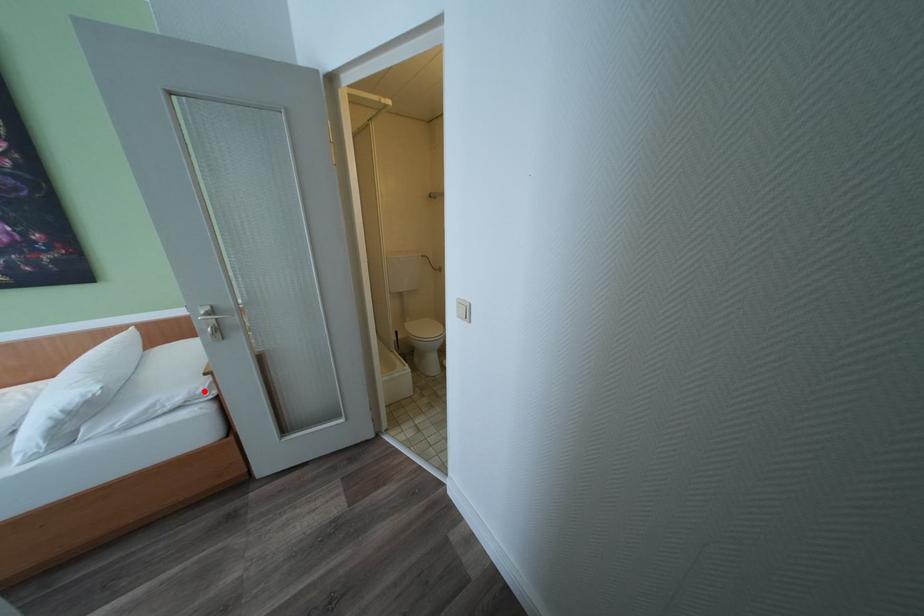
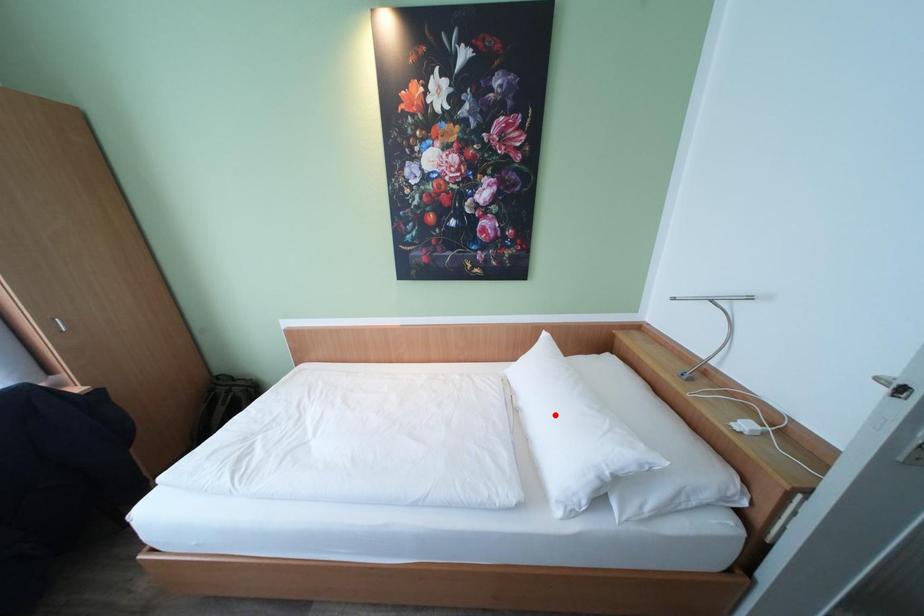
I am providing you with two images of the same scene from different viewpoints. A red point is marked on the first image and another point is marked on the second image. Is the marked point in image1 the same physical position as the marked point in image2?

No